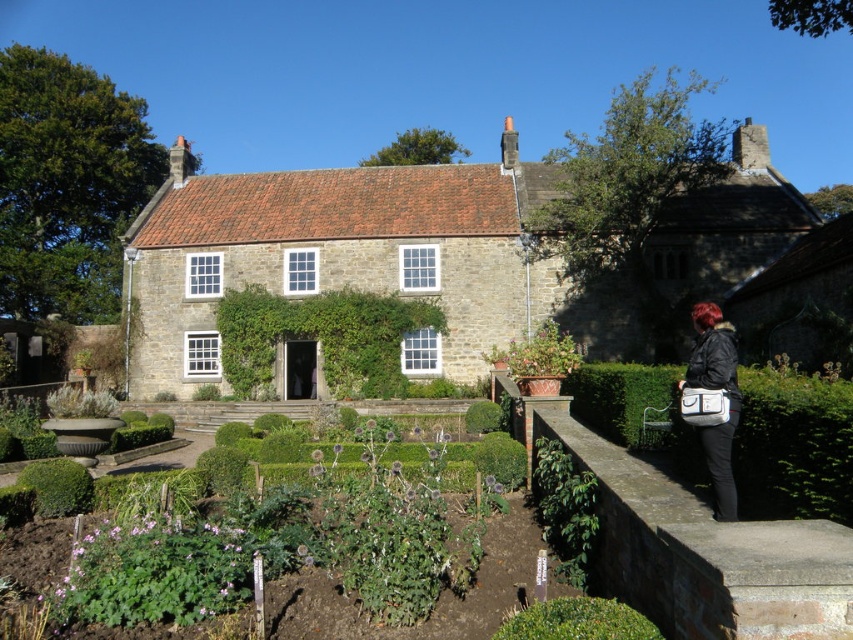
You are standing in front of the stone cottage at center and want to walk towards the green leafy hedge at center. Which direction should you move to reach the hedge?

Since the stone cottage at center is closer to you than the green leafy hedge at center, you should move forward towards the hedge to reach it.

You are standing in front of the stone house and want to determine the relative positions of two points marked in the garden. Which point is closer to you, the point at coordinates point (820, 588) or point (601, 428)?

Point (820, 588) is closer to the viewer than point (601, 428).

You are a gardener who wants to place a new potted plant in the garden. You have the brown stone ledge at lower right and the black leather jacket at lower right available. Which object can you use to place the potted plant on?

The brown stone ledge at lower right can be used to place the potted plant because it is a solid surface, whereas the black leather jacket at lower right is likely not suitable for holding a plant due to its material and purpose.